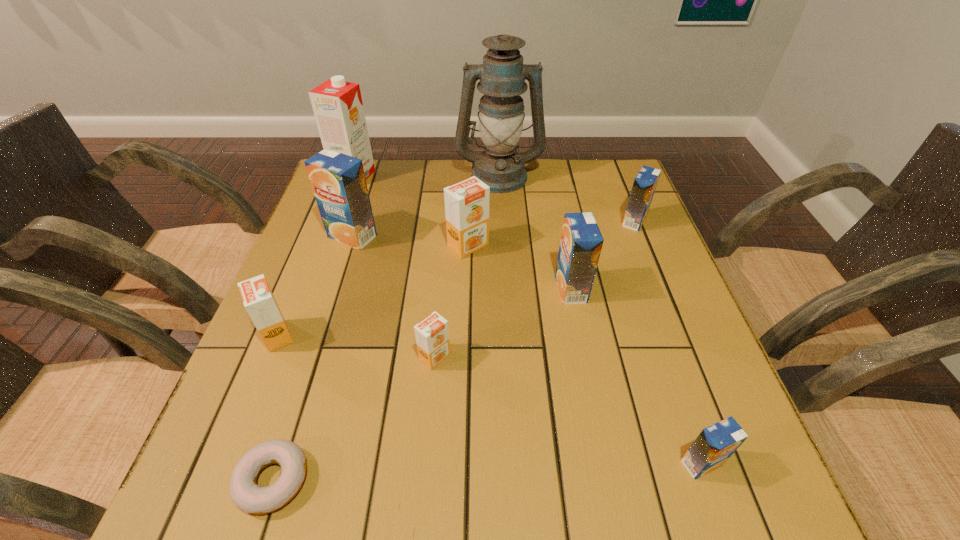
What are the coordinates of `vacant region at the near right corner of the desktop` in the screenshot? It's located at (659, 465).

This screenshot has height=540, width=960. I want to click on unoccupied position between the smallest orange orange juice and the tallest object, so click(x=467, y=266).

Where is `free space between the leftmost orange orange juice and the tallest object`? This screenshot has width=960, height=540. free space between the leftmost orange orange juice and the tallest object is located at coordinates (388, 255).

Where is `blank region between the smallest orange orange juice and the oil lamp`? blank region between the smallest orange orange juice and the oil lamp is located at coordinates (467, 266).

Find the location of `vacant space that is in between the second tallest object and the third biggest blue orange_juice`. vacant space that is in between the second tallest object and the third biggest blue orange_juice is located at coordinates (494, 199).

You are a GUI agent. You are given a task and a screenshot of the screen. Output one action in this format:
    pyautogui.click(x=<x>, y=<y>)
    Task: Click on the blank region between the smallest orange orange juice and the doughnut
    Image resolution: width=960 pixels, height=540 pixels.
    Given the screenshot: What is the action you would take?
    pyautogui.click(x=354, y=418)

Identify the location of vacant space in between the tallest object and the second blue orange_juice from left to right. (535, 232).

This screenshot has height=540, width=960. Find the location of `free point between the farthest orange orange juice and the carton`. free point between the farthest orange orange juice and the carton is located at coordinates (411, 211).

You are a GUI agent. You are given a task and a screenshot of the screen. Output one action in this format:
    pyautogui.click(x=<x>, y=<y>)
    Task: Click on the vacant area between the fifth nearest object and the second smallest orange orange juice
    Image resolution: width=960 pixels, height=540 pixels.
    Given the screenshot: What is the action you would take?
    pyautogui.click(x=424, y=313)

This screenshot has width=960, height=540. Find the location of `free point between the farthest orange orange juice and the smallest orange orange juice`. free point between the farthest orange orange juice and the smallest orange orange juice is located at coordinates (451, 301).